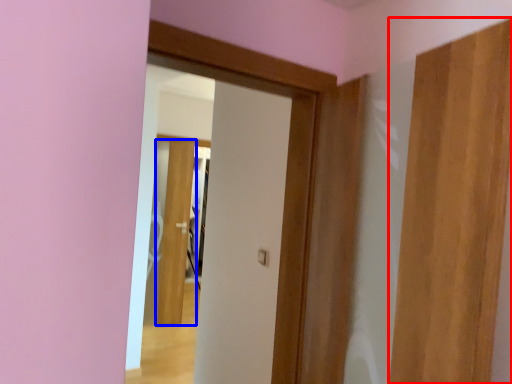
Question: Which of the following is the farthest to the observer, door (highlighted by a red box) or door (highlighted by a blue box)?

Choices:
 (A) door
 (B) door

Answer: (B)